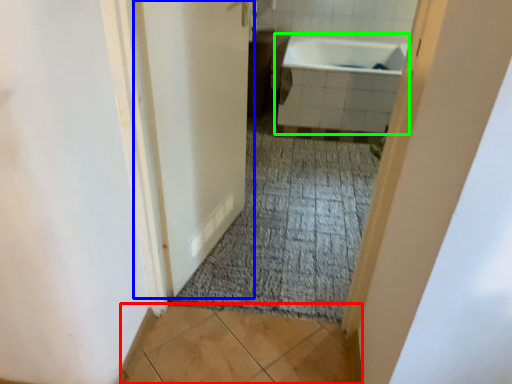
Question: Which object is the farthest from tile (highlighted by a red box)? Choose among these: door (highlighted by a blue box) or bathtub (highlighted by a green box).

Choices:
 (A) door
 (B) bathtub

Answer: (B)